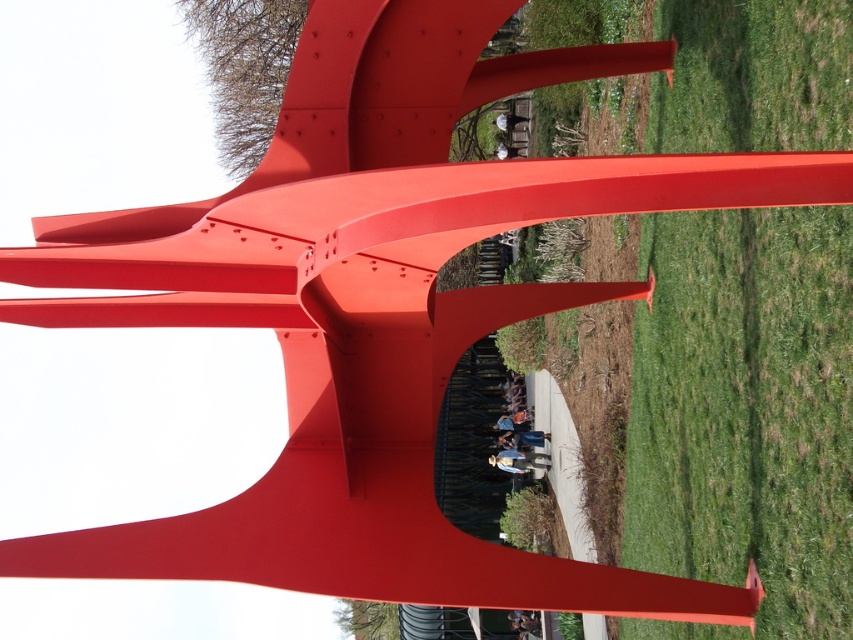
Question: Can you confirm if green grass at center is thinner than dark blue shirt at center?

Choices:
 (A) no
 (B) yes

Answer: (B)

Question: Which of the following is the farthest from the observer?

Choices:
 (A) (525, 616)
 (B) (727, 282)

Answer: (A)

Question: Can you confirm if green grass at center is positioned to the left of dark blue shirt at center?

Choices:
 (A) no
 (B) yes

Answer: (A)

Question: Is green grass at center behind dark blue shirt at center?

Choices:
 (A) no
 (B) yes

Answer: (A)